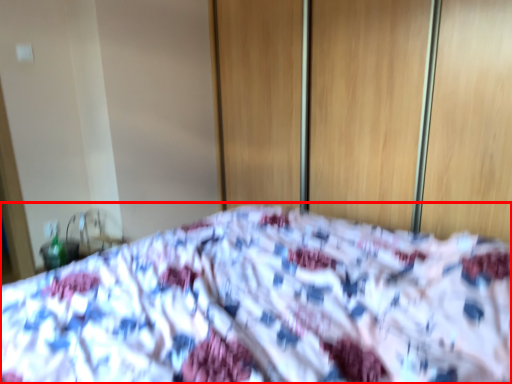
Question: Considering the relative positions of bed (annotated by the red box) and screen door in the image provided, where is bed (annotated by the red box) located with respect to the staircase?

Choices:
 (A) right
 (B) left

Answer: (B)